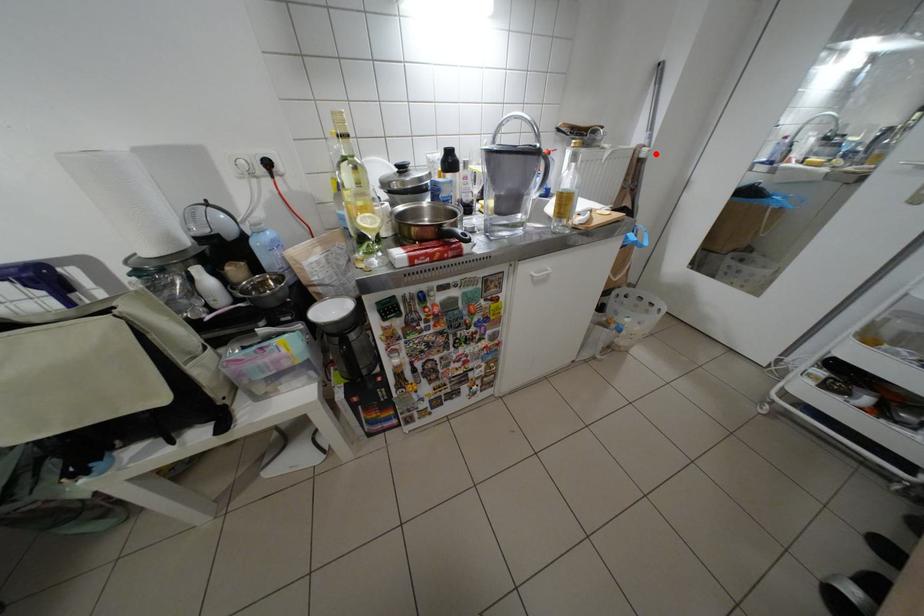
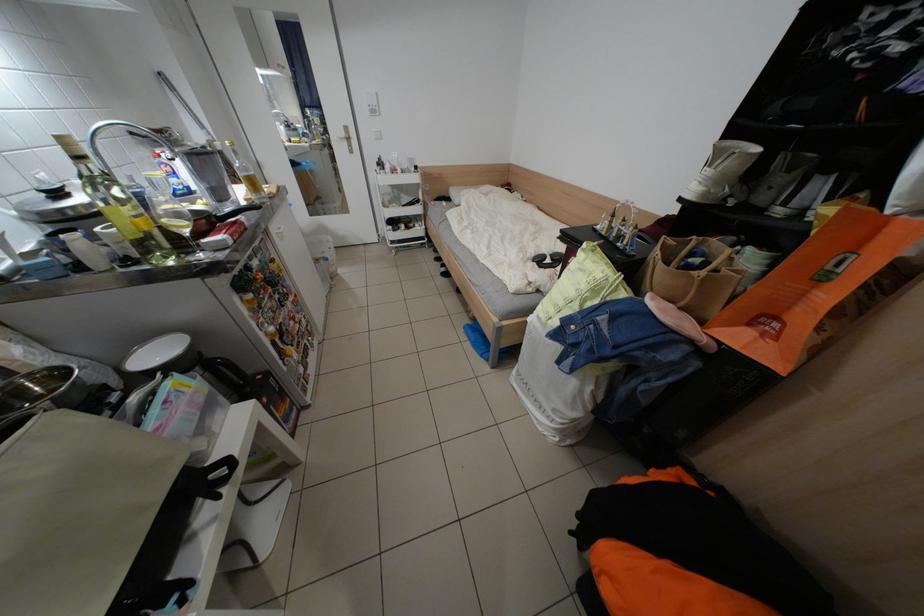
Question: I am providing you with two images of the same scene from different viewpoints. Image1 has a red point marked. In image2, the corresponding 3D location appears at what relative position? Reply with the corresponding letter.

Choices:
 (A) Closer
 (B) Farther

Answer: (B)